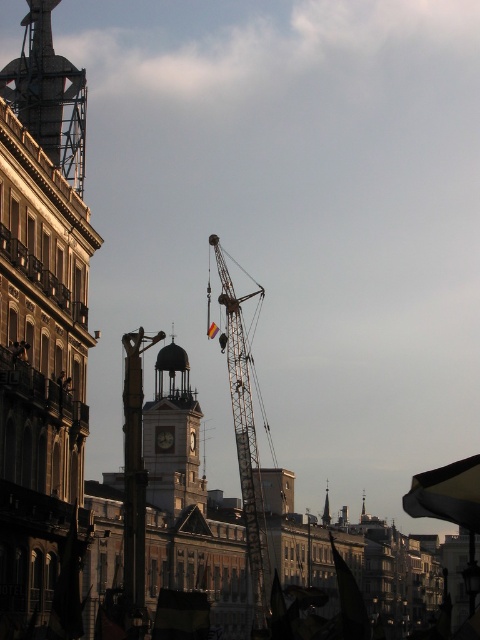
You are a construction worker who needs to secure a safety net between the metallic scaffolding at upper left and the white glossy clock at center. Based on their positions, can you determine which object is higher to properly anchor the net?

The metallic scaffolding at upper left is above the white glossy clock at center, so you should anchor the safety net to the higher metallic scaffolding at upper left to ensure proper coverage.

You are standing at the point marked as point (244,438) in the urban scene. What object are you directly facing?

The point (244,438) corresponds to the metallic gray crane at center, so you are directly facing the metallic gray crane at center.

Consider the image. You are a city planner reviewing the urban scene. You notice two clocks in the image. The matte gray clock tower at center and the white glossy clock at center. Which one is taller?

The matte gray clock tower at center is taller than the white glossy clock at center.